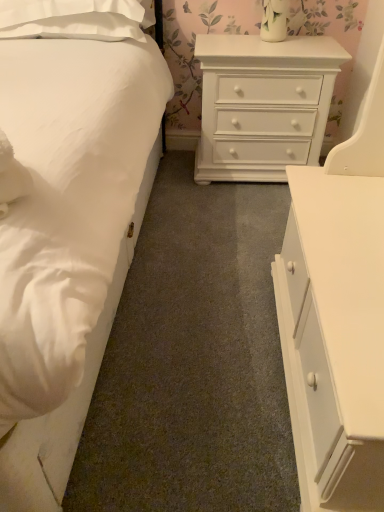
Find the location of a particular element. This screenshot has height=512, width=384. empty space that is ontop of white painted wood chest of drawers at center, arranged as the 1th chest of drawers when viewed from the back (from a real-world perspective) is located at coordinates [x=279, y=40].